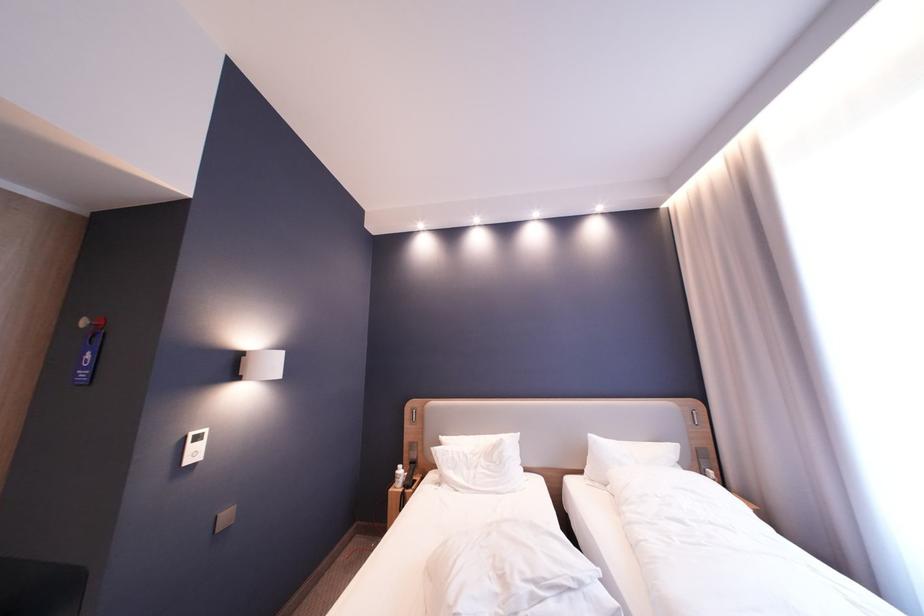
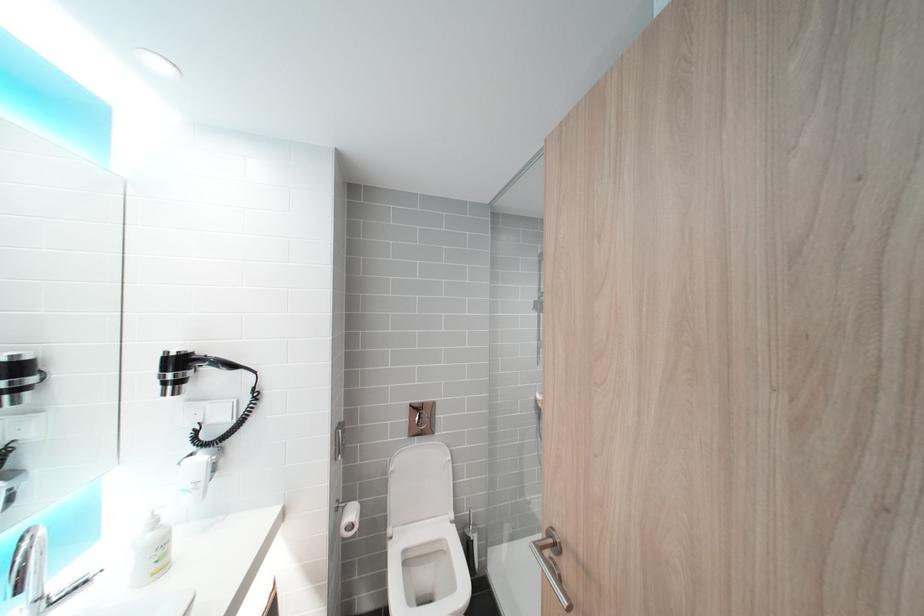
The images are taken continuously from a first-person perspective. In which direction are you moving?

The movement direction of the cameraman is left, forward.